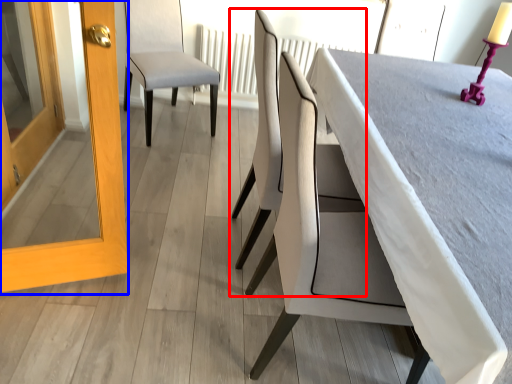
Question: Which point is closer to the camera, chair (highlighted by a red box) or screen door (highlighted by a blue box)?

Choices:
 (A) chair
 (B) screen door

Answer: (B)